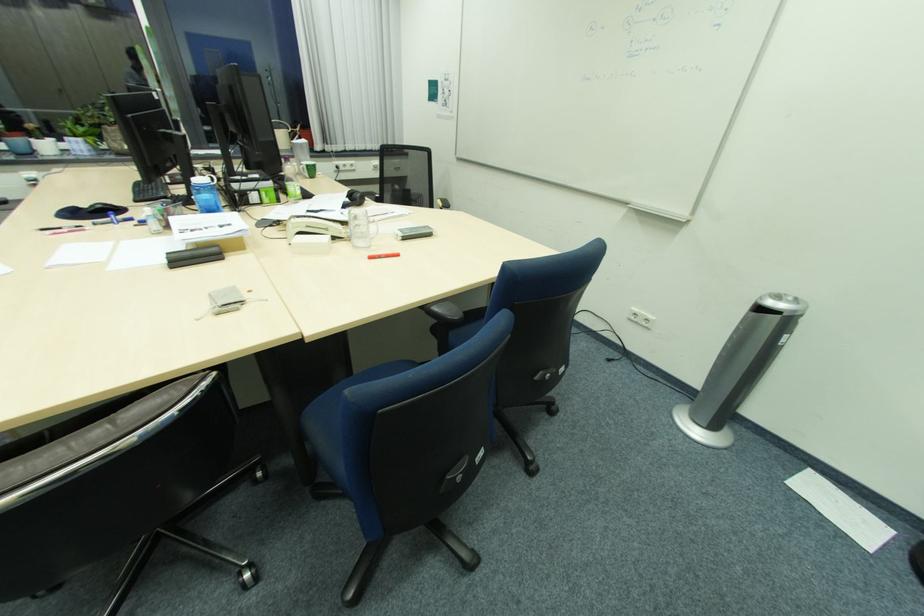
Identify the location of white phone handset. This screenshot has width=924, height=616. (307, 240).